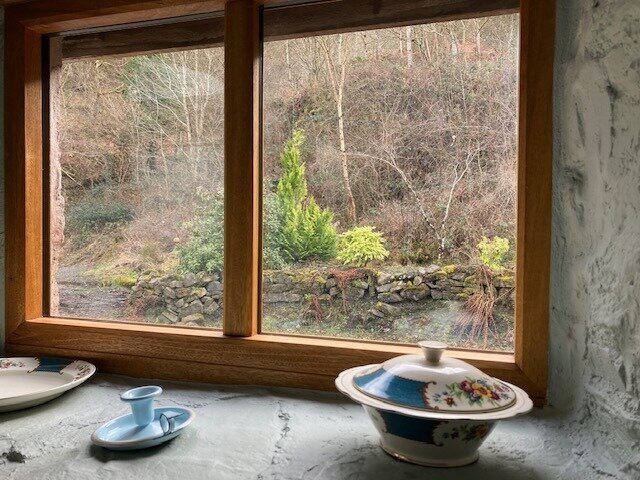
The height and width of the screenshot is (480, 640). I want to click on 2 glass windows, so click(426, 243), click(170, 188).